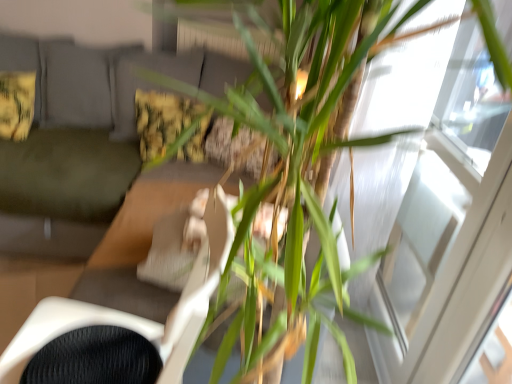
Question: Does white mesh swivel chair at center have a greater width compared to green leafy plant at center?

Choices:
 (A) yes
 (B) no

Answer: (B)

Question: Considering the relative sizes of white mesh swivel chair at center and green leafy plant at center in the image provided, is white mesh swivel chair at center bigger than green leafy plant at center?

Choices:
 (A) no
 (B) yes

Answer: (A)

Question: Does white mesh swivel chair at center have a lesser width compared to green leafy plant at center?

Choices:
 (A) yes
 (B) no

Answer: (A)

Question: From a real-world perspective, is white mesh swivel chair at center located beneath green leafy plant at center?

Choices:
 (A) no
 (B) yes

Answer: (B)

Question: Does white mesh swivel chair at center have a greater height compared to green leafy plant at center?

Choices:
 (A) no
 (B) yes

Answer: (A)

Question: From the image's perspective, is white mesh swivel chair at center on top of green leafy plant at center?

Choices:
 (A) no
 (B) yes

Answer: (A)

Question: Is fluffy yellow pillow at upper left, the 2th pillow when ordered from right to left, taller than transparent glass window at upper right?

Choices:
 (A) yes
 (B) no

Answer: (B)

Question: Is transparent glass window at upper right located within fluffy yellow pillow at upper left, the 2th pillow when ordered from right to left?

Choices:
 (A) yes
 (B) no

Answer: (B)

Question: From the image's perspective, is fluffy yellow pillow at upper left, the 2th pillow when ordered from right to left, beneath transparent glass window at upper right?

Choices:
 (A) yes
 (B) no

Answer: (B)

Question: Does fluffy yellow pillow at upper left, the 2th pillow when ordered from right to left, have a greater width compared to transparent glass window at upper right?

Choices:
 (A) yes
 (B) no

Answer: (A)

Question: Is fluffy yellow pillow at upper left, which is the first pillow from left to right, at the left side of transparent glass window at upper right?

Choices:
 (A) yes
 (B) no

Answer: (A)

Question: Is fluffy yellow pillow at upper left, which is the first pillow from left to right, positioned beyond the bounds of transparent glass window at upper right?

Choices:
 (A) yes
 (B) no

Answer: (A)

Question: Is green fabric couch at left to the left of green leafy plant at center from the viewer's perspective?

Choices:
 (A) no
 (B) yes

Answer: (B)